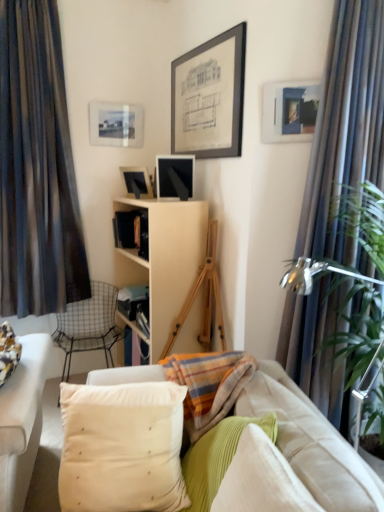
Question: Can you confirm if corduroy fabric pillow at lower right, which is the third pillow in left-to-right order, is taller than dark striped fabric curtain at left, which appears as the 2th curtain when viewed from the front?

Choices:
 (A) no
 (B) yes

Answer: (A)

Question: From the image's perspective, is corduroy fabric pillow at lower right, the first pillow from the right, over dark striped fabric curtain at left, which appears as the 2th curtain when viewed from the front?

Choices:
 (A) no
 (B) yes

Answer: (A)

Question: Is corduroy fabric pillow at lower right, which is the third pillow in left-to-right order, next to dark striped fabric curtain at left, the 2th curtain viewed from the right, and touching it?

Choices:
 (A) no
 (B) yes

Answer: (A)

Question: Is corduroy fabric pillow at lower right, the first pillow from the right, not inside dark striped fabric curtain at left, the first curtain positioned from the back?

Choices:
 (A) no
 (B) yes

Answer: (B)

Question: Can you confirm if corduroy fabric pillow at lower right, the first pillow from the right, is smaller than dark striped fabric curtain at left, which appears as the 2th curtain when viewed from the front?

Choices:
 (A) no
 (B) yes

Answer: (B)

Question: Is silky blue curtain at right, acting as the first curtain starting from the right, to the left or to the right of soft beige fabric couch at center in the image?

Choices:
 (A) left
 (B) right

Answer: (B)

Question: Is silky blue curtain at right, acting as the first curtain starting from the right, inside or outside of soft beige fabric couch at center?

Choices:
 (A) outside
 (B) inside

Answer: (A)

Question: Considering the positions of silky blue curtain at right, acting as the first curtain starting from the right, and soft beige fabric couch at center in the image, is silky blue curtain at right, acting as the first curtain starting from the right, taller or shorter than soft beige fabric couch at center?

Choices:
 (A) short
 (B) tall

Answer: (B)

Question: From a real-world perspective, is silky blue curtain at right, which is the second curtain from left to right, positioned above or below soft beige fabric couch at center?

Choices:
 (A) below
 (B) above

Answer: (B)

Question: Considering the positions of point (231, 432) and point (286, 466), is point (231, 432) closer or farther from the camera than point (286, 466)?

Choices:
 (A) farther
 (B) closer

Answer: (A)

Question: From the image's perspective, is green corduroy pillow at center, which is the 2th pillow from right to left, located above or below corduroy fabric pillow at lower right, the first pillow from the right?

Choices:
 (A) below
 (B) above

Answer: (A)

Question: From a real-world perspective, is green corduroy pillow at center, which is the 2th pillow from right to left, physically located above or below corduroy fabric pillow at lower right, which is the third pillow in left-to-right order?

Choices:
 (A) above
 (B) below

Answer: (B)

Question: Is green corduroy pillow at center, which is the 2th pillow from right to left, to the left or to the right of corduroy fabric pillow at lower right, which is the third pillow in left-to-right order, in the image?

Choices:
 (A) right
 (B) left

Answer: (B)

Question: From the image's perspective, is green corduroy pillow at center, the 2th pillow when ordered from left to right, positioned above or below silky blue curtain at right, acting as the first curtain starting from the right?

Choices:
 (A) above
 (B) below

Answer: (B)

Question: Considering the relative positions of green corduroy pillow at center, which is the 2th pillow from right to left, and silky blue curtain at right, which is the 2th curtain from back to front, in the image provided, is green corduroy pillow at center, which is the 2th pillow from right to left, to the left or to the right of silky blue curtain at right, which is the 2th curtain from back to front,?

Choices:
 (A) right
 (B) left

Answer: (B)